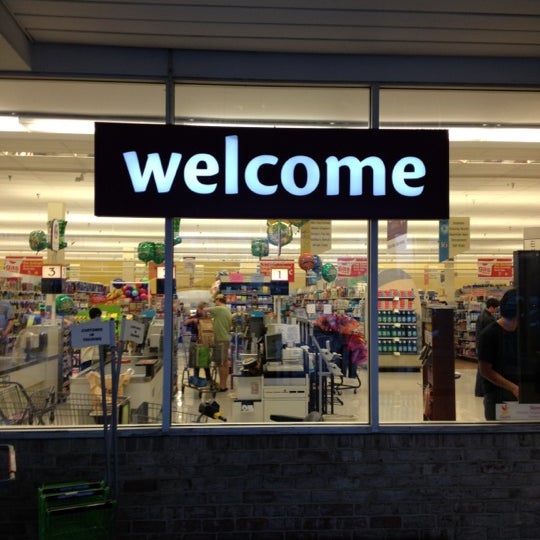
You are a GUI agent. You are given a task and a screenshot of the screen. Output one action in this format:
    pyautogui.click(x=<x>, y=<y>)
    Task: Click on the lights
    This screenshot has height=540, width=540.
    Given the screenshot: What is the action you would take?
    pyautogui.click(x=220, y=228), pyautogui.click(x=219, y=242), pyautogui.click(x=218, y=256), pyautogui.click(x=94, y=225), pyautogui.click(x=105, y=241), pyautogui.click(x=110, y=258), pyautogui.click(x=357, y=244), pyautogui.click(x=351, y=255), pyautogui.click(x=347, y=236), pyautogui.click(x=347, y=222)